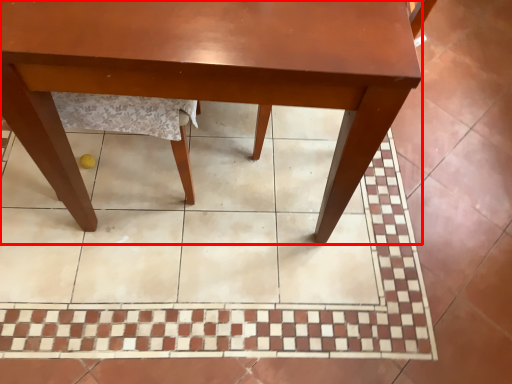
Question: From the image's perspective, where is table (annotated by the red box) located relative to ceramic tile?

Choices:
 (A) above
 (B) below

Answer: (A)